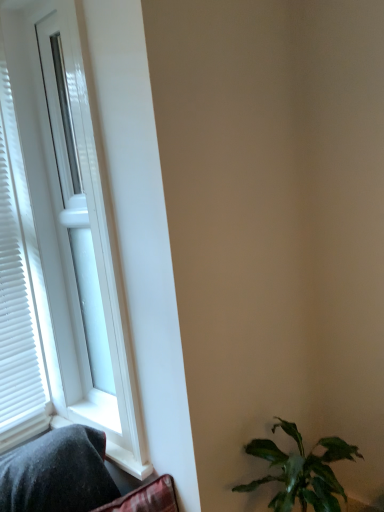
Question: From the image's perspective, relative to green leafy plant at lower right, is white glossy window at left above or below?

Choices:
 (A) below
 (B) above

Answer: (B)

Question: In terms of width, does white glossy window at left look wider or thinner when compared to green leafy plant at lower right?

Choices:
 (A) thin
 (B) wide

Answer: (A)

Question: In terms of size, does white glossy window at left appear bigger or smaller than green leafy plant at lower right?

Choices:
 (A) big
 (B) small

Answer: (A)

Question: Choose the correct answer: Is green leafy plant at lower right inside white glossy window at left or outside it?

Choices:
 (A) inside
 (B) outside

Answer: (B)

Question: In terms of width, does green leafy plant at lower right look wider or thinner when compared to white glossy window at left?

Choices:
 (A) thin
 (B) wide

Answer: (B)

Question: From their relative heights in the image, would you say green leafy plant at lower right is taller or shorter than white glossy window at left?

Choices:
 (A) tall
 (B) short

Answer: (B)

Question: Based on their sizes in the image, would you say green leafy plant at lower right is bigger or smaller than white glossy window at left?

Choices:
 (A) big
 (B) small

Answer: (B)